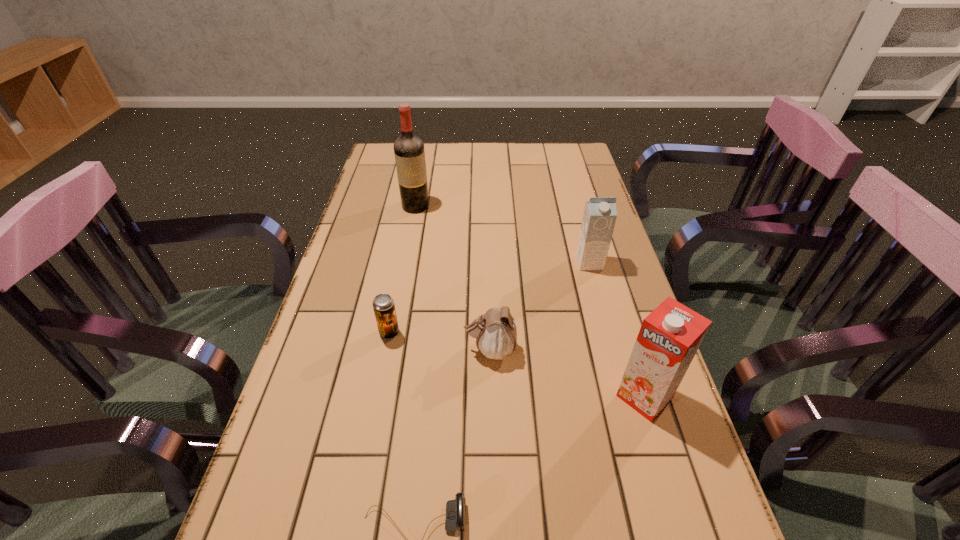
This screenshot has height=540, width=960. What are the coordinates of `the tallest object` in the screenshot? It's located at (409, 152).

Identify the location of the farthest object. (409, 152).

Where is `the fifth shortest object`? This screenshot has width=960, height=540. the fifth shortest object is located at coordinates (669, 337).

At what (x,y) coordinates should I click in order to perform the action: click on the fifth farthest object. Please return your answer as a coordinate pair (x, y). Looking at the image, I should click on (669, 337).

The height and width of the screenshot is (540, 960). In order to click on the shorter carton in this screenshot , I will do `click(600, 213)`.

You are a GUI agent. You are given a task and a screenshot of the screen. Output one action in this format:
    pyautogui.click(x=<x>, y=<y>)
    Task: Click on the third tallest object
    
    Given the screenshot: What is the action you would take?
    point(600,213)

Where is `pouch`? pouch is located at coordinates (495, 331).

Where is `the fifth tallest object`? the fifth tallest object is located at coordinates (383, 304).

You are a GUI agent. You are given a task and a screenshot of the screen. Output one action in this format:
    pyautogui.click(x=<x>, y=<y>)
    Task: Click on the free region located 0.300m on the front-facing side of the farthest object
    This screenshot has width=960, height=540.
    Given the screenshot: What is the action you would take?
    pyautogui.click(x=402, y=279)

You are a GUI agent. You are given a task and a screenshot of the screen. Output one action in this format:
    pyautogui.click(x=<x>, y=<y>)
    Task: Click on the free region located 0.190m on the back of the second tallest object
    
    Given the screenshot: What is the action you would take?
    pyautogui.click(x=617, y=309)